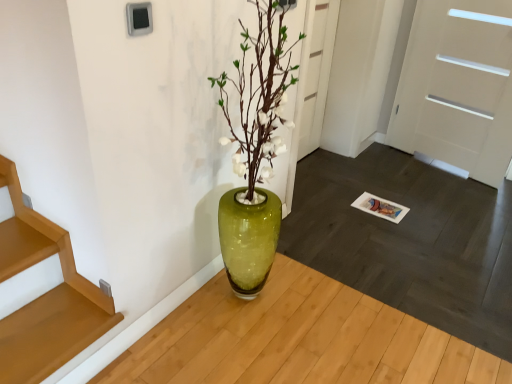
Question: Is white glossy door at right, the first door positioned from the right, to the left of white matte door at center, positioned as the 1th door in left-to-right order, from the viewer's perspective?

Choices:
 (A) no
 (B) yes

Answer: (A)

Question: Is white glossy door at right, which is the second door from left to right, touching white matte door at center, the 2th door when ordered from right to left?

Choices:
 (A) no
 (B) yes

Answer: (A)

Question: Considering the relative sizes of white glossy door at right, the first door positioned from the right, and white matte door at center, the 2th door when ordered from right to left, in the image provided, is white glossy door at right, the first door positioned from the right, bigger than white matte door at center, the 2th door when ordered from right to left,?

Choices:
 (A) yes
 (B) no

Answer: (A)

Question: Does white glossy door at right, which is the second door from left to right, lie in front of white matte door at center, positioned as the 1th door in left-to-right order?

Choices:
 (A) no
 (B) yes

Answer: (B)

Question: From the image's perspective, is white glossy door at right, the first door positioned from the right, located beneath white matte door at center, positioned as the 1th door in left-to-right order?

Choices:
 (A) yes
 (B) no

Answer: (A)

Question: Is white glossy door at right, the first door positioned from the right, taller than white matte door at center, the 2th door when ordered from right to left?

Choices:
 (A) yes
 (B) no

Answer: (A)

Question: Is white matte door at center, positioned as the 1th door in left-to-right order, to the right of white glossy door at right, which is the second door from left to right, from the viewer's perspective?

Choices:
 (A) no
 (B) yes

Answer: (A)

Question: Is white matte door at center, positioned as the 1th door in left-to-right order, wider than white glossy door at right, the first door positioned from the right?

Choices:
 (A) yes
 (B) no

Answer: (B)

Question: Is white matte door at center, positioned as the 1th door in left-to-right order, in contact with white glossy door at right, the first door positioned from the right?

Choices:
 (A) no
 (B) yes

Answer: (A)

Question: Is white matte door at center, the 2th door when ordered from right to left, oriented towards white glossy door at right, the first door positioned from the right?

Choices:
 (A) yes
 (B) no

Answer: (B)

Question: Is the depth of white matte door at center, positioned as the 1th door in left-to-right order, greater than that of white glossy door at right, the first door positioned from the right?

Choices:
 (A) no
 (B) yes

Answer: (B)

Question: Is white matte door at center, the 2th door when ordered from right to left, not within white glossy door at right, the first door positioned from the right?

Choices:
 (A) yes
 (B) no

Answer: (A)

Question: Is white matte door at center, the 2th door when ordered from right to left, taller or shorter than white glossy door at right, which is the second door from left to right?

Choices:
 (A) short
 (B) tall

Answer: (A)